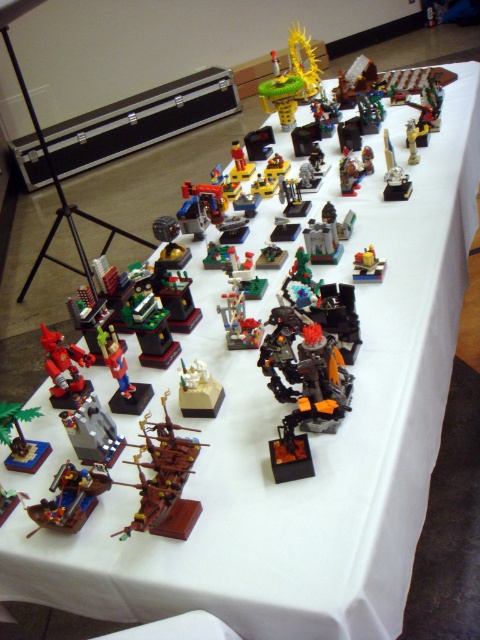
Question: Which of the following is the closest to the observer?

Choices:
 (A) metallic silver tower at center
 (B) yellow metallic dragon at upper center
 (C) translucent orange robot at center
 (D) translucent yellow brick at center

Answer: (D)

Question: Which of the following is the farthest from the observer?

Choices:
 (A) yellow metallic dragon at upper center
 (B) metallic orange robot at center
 (C) brick red wooden ship at lower left

Answer: (A)

Question: Which of these objects is positioned closest to the brown wooden ship at center?

Choices:
 (A) shiny red robot at lower left
 (B) brick red wooden ship at lower left

Answer: (B)

Question: Is brick red wooden ship at lower left above yellow metallic dragon at upper center?

Choices:
 (A) no
 (B) yes

Answer: (A)

Question: Does metallic orange robot at center have a greater width compared to translucent orange robot at center?

Choices:
 (A) no
 (B) yes

Answer: (A)

Question: Considering the relative positions of shiny metallic robot at center and metallic silver tower at center in the image provided, where is shiny metallic robot at center located with respect to metallic silver tower at center?

Choices:
 (A) right
 (B) left

Answer: (A)